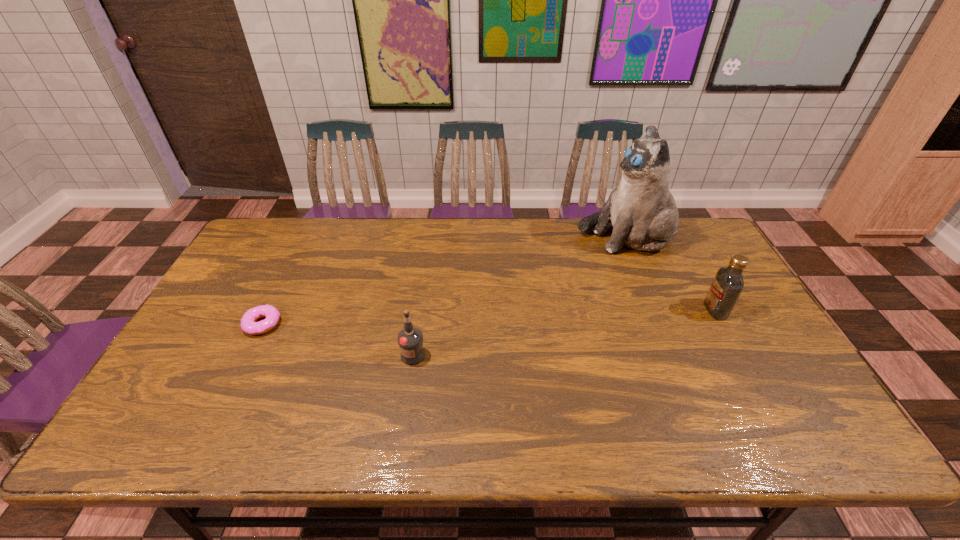
The height and width of the screenshot is (540, 960). Find the location of `object located in the far right corner section of the desktop`. object located in the far right corner section of the desktop is located at coordinates (641, 208).

Identify the location of vacant space at the far edge. (390, 218).

What are the coordinates of `free space at the near edge of the desktop` in the screenshot? It's located at (268, 434).

Locate an element on the screen. This screenshot has width=960, height=540. blank space at the left edge of the desktop is located at coordinates (247, 266).

Find the location of a particular element. vacant space at the right edge of the desktop is located at coordinates (739, 369).

Image resolution: width=960 pixels, height=540 pixels. In order to click on free space at the far left corner of the desktop in this screenshot , I will do `click(288, 222)`.

Identify the location of empty location between the cat and the right vodka. (670, 273).

Where is `vacant area that lies between the left vodka and the third shortest object`? This screenshot has height=540, width=960. vacant area that lies between the left vodka and the third shortest object is located at coordinates (564, 333).

Where is `free spot between the taller vodka and the second shortest object`? This screenshot has height=540, width=960. free spot between the taller vodka and the second shortest object is located at coordinates (564, 333).

The height and width of the screenshot is (540, 960). What are the coordinates of `free spot between the taller vodka and the leftmost object` in the screenshot? It's located at (489, 317).